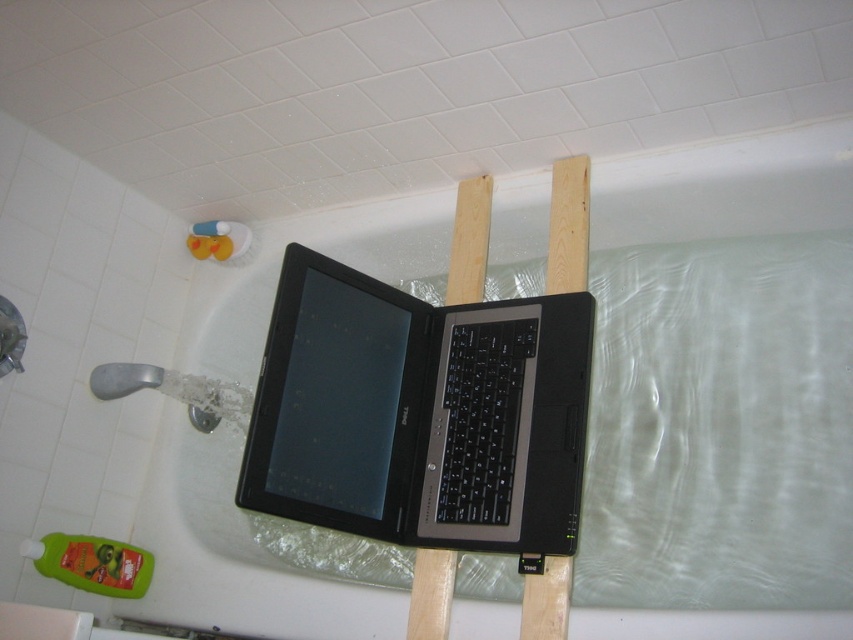
Question: Is clear plastic bath at upper center below wooden plank at center?

Choices:
 (A) yes
 (B) no

Answer: (A)

Question: Does black matte laptop at center come in front of wooden plank at center?

Choices:
 (A) yes
 (B) no

Answer: (A)

Question: Is black matte laptop at center in front of wooden plank at upper center?

Choices:
 (A) no
 (B) yes

Answer: (B)

Question: Which object is the farthest from the wooden plank at upper center?

Choices:
 (A) wooden plank at center
 (B) black matte laptop at center

Answer: (B)

Question: Which point is farther to the camera?

Choices:
 (A) (433, 582)
 (B) (509, 216)

Answer: (B)

Question: Which point is closer to the camera?

Choices:
 (A) (245, 268)
 (B) (432, 589)
 (C) (503, 544)

Answer: (C)